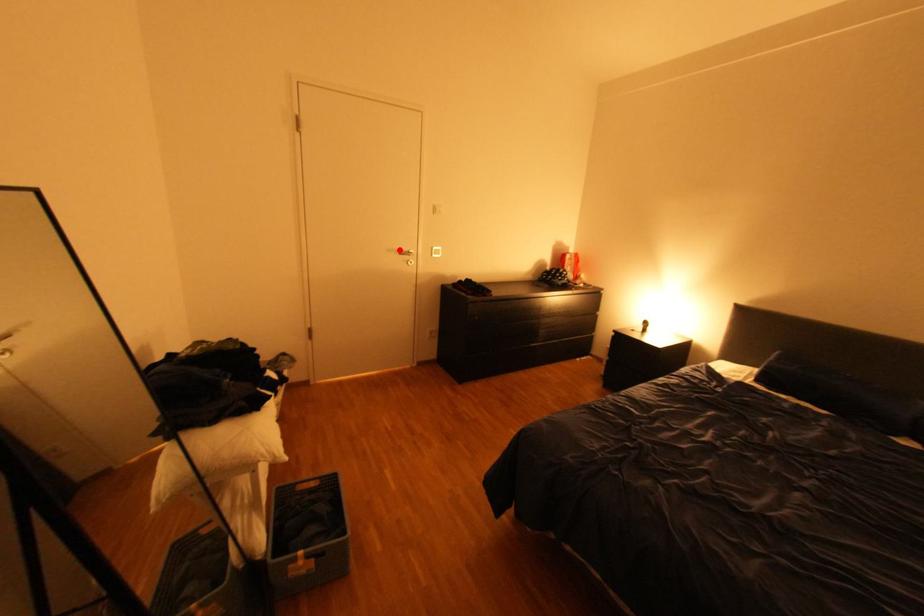
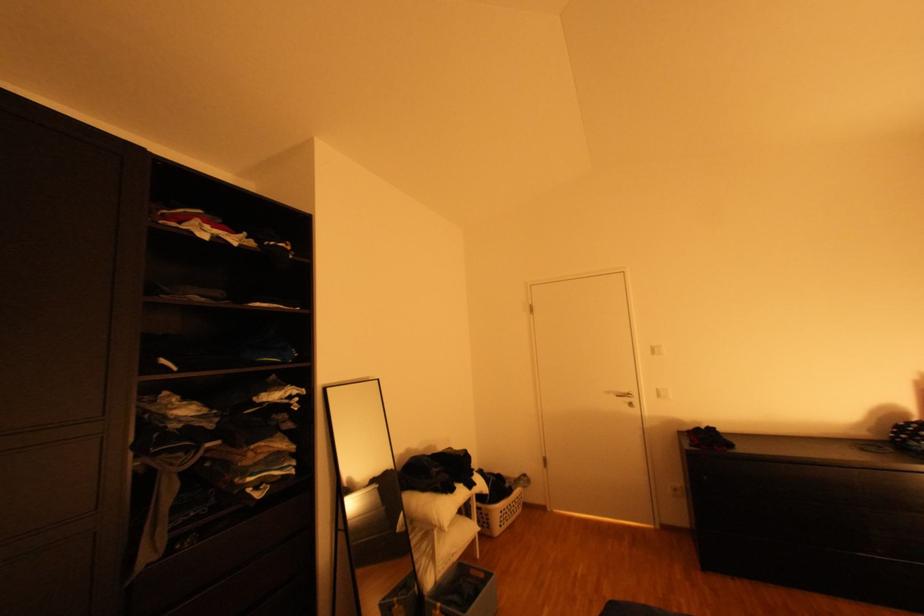
Question: I am providing you with two images of the same scene from different viewpoints. A red point is marked on the first image. Is the red point's position out of view in image 2?

Choices:
 (A) Yes
 (B) No

Answer: (B)